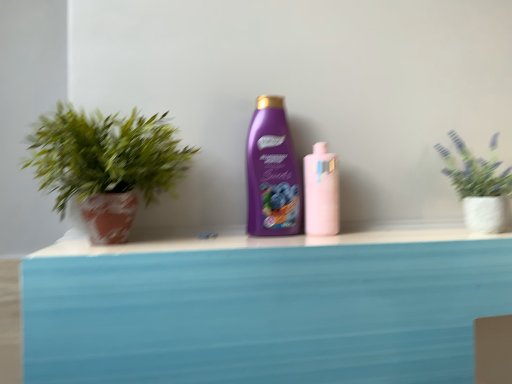
What do you see at coordinates (106, 165) in the screenshot?
I see `green matte plant at left, the 1th houseplant viewed from the left` at bounding box center [106, 165].

Where is `purple glossy shampoo at center, the 2th bottle viewed from the right`? purple glossy shampoo at center, the 2th bottle viewed from the right is located at coordinates (272, 172).

Describe the element at coordinates (478, 185) in the screenshot. I see `green leafy plant in textured pot at upper right, which is the second houseplant from left to right` at that location.

At what (x,y) coordinates should I click in order to perform the action: click on pink glossy bottle at center, the 1th bottle when ordered from right to left. Please return your answer as a coordinate pair (x, y). Looking at the image, I should click on (321, 192).

Identify the location of houseplant below the green matte plant at left, the 1th houseplant viewed from the left (from the image's perspective). (478, 185).

From the picture: Looking at the image, does green leafy plant in textured pot at upper right, which is the second houseplant from left to right, seem bigger or smaller compared to green matte plant at left, placed as the 2th houseplant when sorted from right to left?

green leafy plant in textured pot at upper right, which is the second houseplant from left to right, is smaller than green matte plant at left, placed as the 2th houseplant when sorted from right to left.

Does point (490, 182) come farther from viewer compared to point (38, 152)?

That is True.

Considering the relative positions of purple glossy shampoo at center, the 2th bottle viewed from the right, and green leafy plant in textured pot at upper right, which is the second houseplant from left to right, in the image provided, is purple glossy shampoo at center, the 2th bottle viewed from the right, to the right of green leafy plant in textured pot at upper right, which is the second houseplant from left to right, from the viewer's perspective?

Incorrect, purple glossy shampoo at center, the 2th bottle viewed from the right, is not on the right side of green leafy plant in textured pot at upper right, which is the second houseplant from left to right.

Is point (263, 156) closer or farther from the camera than point (490, 215)?

Point (263, 156).

Is green leafy plant in textured pot at upper right, which is the second houseplant from left to right, surrounded by purple glossy shampoo at center, the 2th bottle viewed from the right?

No, green leafy plant in textured pot at upper right, which is the second houseplant from left to right, is located outside of purple glossy shampoo at center, the 2th bottle viewed from the right.

From the image's perspective, which is above, purple glossy shampoo at center, the first bottle in the left-to-right sequence, or green leafy plant in textured pot at upper right, which is the second houseplant from left to right?

purple glossy shampoo at center, the first bottle in the left-to-right sequence, appears higher in the image.

Image resolution: width=512 pixels, height=384 pixels. I want to click on houseplant below the green matte plant at left, placed as the 2th houseplant when sorted from right to left (from a real-world perspective), so click(478, 185).

Can you confirm if green matte plant at left, the 1th houseplant viewed from the left, is wider than green leafy plant in textured pot at upper right, the 1th houseplant viewed from the right?

Indeed, green matte plant at left, the 1th houseplant viewed from the left, has a greater width compared to green leafy plant in textured pot at upper right, the 1th houseplant viewed from the right.

From a real-world perspective, relative to green leafy plant in textured pot at upper right, which is the second houseplant from left to right, is green matte plant at left, the 1th houseplant viewed from the left, vertically above or below?

Clearly, from a real-world perspective, green matte plant at left, the 1th houseplant viewed from the left, is above green leafy plant in textured pot at upper right, which is the second houseplant from left to right.

Does green matte plant at left, placed as the 2th houseplant when sorted from right to left, turn towards green leafy plant in textured pot at upper right, which is the second houseplant from left to right?

No, green matte plant at left, placed as the 2th houseplant when sorted from right to left, is not aimed at green leafy plant in textured pot at upper right, which is the second houseplant from left to right.

From a real-world perspective, is green leafy plant in textured pot at upper right, which is the second houseplant from left to right, physically below purple glossy shampoo at center, the 2th bottle viewed from the right?

Yes, from a real-world perspective, green leafy plant in textured pot at upper right, which is the second houseplant from left to right, is below purple glossy shampoo at center, the 2th bottle viewed from the right.

Is green leafy plant in textured pot at upper right, which is the second houseplant from left to right, outside of purple glossy shampoo at center, the 2th bottle viewed from the right?

That's correct, green leafy plant in textured pot at upper right, which is the second houseplant from left to right, is outside of purple glossy shampoo at center, the 2th bottle viewed from the right.

Locate an element on the screen. This screenshot has width=512, height=384. houseplant to the right of purple glossy shampoo at center, the first bottle in the left-to-right sequence is located at coordinates (478, 185).

Does green leafy plant in textured pot at upper right, which is the second houseplant from left to right, have a smaller size compared to purple glossy shampoo at center, the 2th bottle viewed from the right?

No, green leafy plant in textured pot at upper right, which is the second houseplant from left to right, is not smaller than purple glossy shampoo at center, the 2th bottle viewed from the right.

Are pink glossy bottle at center, the 1th bottle when ordered from right to left, and green matte plant at left, placed as the 2th houseplant when sorted from right to left, beside each other?

No, pink glossy bottle at center, the 1th bottle when ordered from right to left, is not next to green matte plant at left, placed as the 2th houseplant when sorted from right to left.

Is pink glossy bottle at center, the 1th bottle when ordered from right to left, positioned behind green matte plant at left, placed as the 2th houseplant when sorted from right to left?

That is True.

Considering the points (324, 203) and (119, 203), which point is behind, point (324, 203) or point (119, 203)?

The point (324, 203) is more distant.

In the scene shown: From the image's perspective, relative to pink glossy bottle at center, which appears as the 2th bottle when viewed from the left, is green leafy plant in textured pot at upper right, which is the second houseplant from left to right, above or below?

Clearly, from the image's perspective, green leafy plant in textured pot at upper right, which is the second houseplant from left to right, is above pink glossy bottle at center, which appears as the 2th bottle when viewed from the left.

Between green leafy plant in textured pot at upper right, which is the second houseplant from left to right, and pink glossy bottle at center, the 1th bottle when ordered from right to left, which one has larger size?

Bigger between the two is green leafy plant in textured pot at upper right, which is the second houseplant from left to right.

Is green leafy plant in textured pot at upper right, the 1th houseplant viewed from the right, to the left of pink glossy bottle at center, which appears as the 2th bottle when viewed from the left, from the viewer's perspective?

No.

Are green leafy plant in textured pot at upper right, which is the second houseplant from left to right, and pink glossy bottle at center, the 1th bottle when ordered from right to left, far apart?

No, there isn't a large distance between green leafy plant in textured pot at upper right, which is the second houseplant from left to right, and pink glossy bottle at center, the 1th bottle when ordered from right to left.

Relative to green leafy plant in textured pot at upper right, the 1th houseplant viewed from the right, is pink glossy bottle at center, the 1th bottle when ordered from right to left, in front or behind?

pink glossy bottle at center, the 1th bottle when ordered from right to left, is behind green leafy plant in textured pot at upper right, the 1th houseplant viewed from the right.

Considering the sizes of objects pink glossy bottle at center, the 1th bottle when ordered from right to left, and green leafy plant in textured pot at upper right, the 1th houseplant viewed from the right, in the image provided, who is wider, pink glossy bottle at center, the 1th bottle when ordered from right to left, or green leafy plant in textured pot at upper right, the 1th houseplant viewed from the right,?

With larger width is green leafy plant in textured pot at upper right, the 1th houseplant viewed from the right.

Is pink glossy bottle at center, the 1th bottle when ordered from right to left, in contact with green leafy plant in textured pot at upper right, the 1th houseplant viewed from the right?

No, pink glossy bottle at center, the 1th bottle when ordered from right to left, is not touching green leafy plant in textured pot at upper right, the 1th houseplant viewed from the right.

Locate an element on the screen. houseplant located above the green leafy plant in textured pot at upper right, the 1th houseplant viewed from the right (from the image's perspective) is located at coordinates (106, 165).

You are a GUI agent. You are given a task and a screenshot of the screen. Output one action in this format:
    pyautogui.click(x=<x>, y=<y>)
    Task: Click on the 2nd houseplant positioned below the purple glossy shampoo at center, the first bottle in the left-to-right sequence (from a real-world perspective)
    
    Given the screenshot: What is the action you would take?
    pyautogui.click(x=478, y=185)

Based on their spatial positions, is green leafy plant in textured pot at upper right, the 1th houseplant viewed from the right, or pink glossy bottle at center, which appears as the 2th bottle when viewed from the left, further from green matte plant at left, placed as the 2th houseplant when sorted from right to left?

green leafy plant in textured pot at upper right, the 1th houseplant viewed from the right, lies further to green matte plant at left, placed as the 2th houseplant when sorted from right to left, than the other object.

Based on their spatial positions, is purple glossy shampoo at center, the first bottle in the left-to-right sequence, or pink glossy bottle at center, which appears as the 2th bottle when viewed from the left, closer to green matte plant at left, the 1th houseplant viewed from the left?

purple glossy shampoo at center, the first bottle in the left-to-right sequence, lies closer to green matte plant at left, the 1th houseplant viewed from the left, than the other object.

Considering their positions, is green matte plant at left, placed as the 2th houseplant when sorted from right to left, positioned closer to purple glossy shampoo at center, the first bottle in the left-to-right sequence, than pink glossy bottle at center, the 1th bottle when ordered from right to left?

pink glossy bottle at center, the 1th bottle when ordered from right to left, lies closer to purple glossy shampoo at center, the first bottle in the left-to-right sequence, than the other object.

In the scene shown: Based on their spatial positions, is green matte plant at left, the 1th houseplant viewed from the left, or green leafy plant in textured pot at upper right, which is the second houseplant from left to right, further from purple glossy shampoo at center, the 2th bottle viewed from the right?

Based on the image, green leafy plant in textured pot at upper right, which is the second houseplant from left to right, appears to be further to purple glossy shampoo at center, the 2th bottle viewed from the right.

Which object lies further to the anchor point pink glossy bottle at center, which appears as the 2th bottle when viewed from the left, purple glossy shampoo at center, the 2th bottle viewed from the right, or green matte plant at left, placed as the 2th houseplant when sorted from right to left?

Based on the image, green matte plant at left, placed as the 2th houseplant when sorted from right to left, appears to be further to pink glossy bottle at center, which appears as the 2th bottle when viewed from the left.

Considering their positions, is pink glossy bottle at center, the 1th bottle when ordered from right to left, positioned further to purple glossy shampoo at center, the 2th bottle viewed from the right, than green matte plant at left, placed as the 2th houseplant when sorted from right to left?

green matte plant at left, placed as the 2th houseplant when sorted from right to left, is further to purple glossy shampoo at center, the 2th bottle viewed from the right.

Consider the image. From the image, which object appears to be farther from green leafy plant in textured pot at upper right, which is the second houseplant from left to right, green matte plant at left, placed as the 2th houseplant when sorted from right to left, or purple glossy shampoo at center, the 2th bottle viewed from the right?

Among the two, green matte plant at left, placed as the 2th houseplant when sorted from right to left, is located further to green leafy plant in textured pot at upper right, which is the second houseplant from left to right.

When comparing their distances from green leafy plant in textured pot at upper right, which is the second houseplant from left to right, does purple glossy shampoo at center, the 2th bottle viewed from the right, or green matte plant at left, the 1th houseplant viewed from the left, seem closer?

purple glossy shampoo at center, the 2th bottle viewed from the right, is closer to green leafy plant in textured pot at upper right, which is the second houseplant from left to right.

Find the location of a particular element. bottle between purple glossy shampoo at center, the first bottle in the left-to-right sequence, and green leafy plant in textured pot at upper right, the 1th houseplant viewed from the right is located at coordinates (321, 192).

You are a GUI agent. You are given a task and a screenshot of the screen. Output one action in this format:
    pyautogui.click(x=<x>, y=<y>)
    Task: Click on the bottle between green matte plant at left, the 1th houseplant viewed from the left, and pink glossy bottle at center, the 1th bottle when ordered from right to left, in the horizontal direction
    
    Given the screenshot: What is the action you would take?
    pyautogui.click(x=272, y=172)